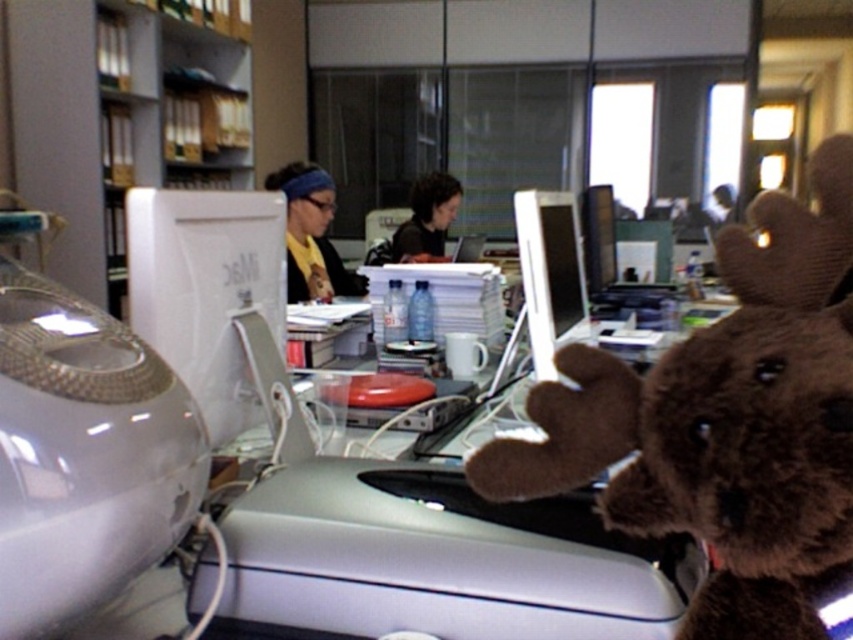
Does white plastic bookshelf at left have a greater width compared to matte black hairband at upper center?

Indeed, white plastic bookshelf at left has a greater width compared to matte black hairband at upper center.

Between white plastic bookshelf at left and matte black hairband at upper center, which one is positioned lower?

matte black hairband at upper center

Which is behind, point (73, 257) or point (291, 170)?

The point (291, 170) is behind.

Find the location of `white plastic bookshelf at left`. white plastic bookshelf at left is located at coordinates (120, 116).

Is matte black hairband at upper center smaller than dark brown plush toy at center?

Yes.

Does matte black hairband at upper center appear over dark brown plush toy at center?

No, matte black hairband at upper center is not above dark brown plush toy at center.

Does point (291, 244) come farther from viewer compared to point (430, 218)?

No, it is in front of (430, 218).

You are a GUI agent. You are given a task and a screenshot of the screen. Output one action in this format:
    pyautogui.click(x=<x>, y=<y>)
    Task: Click on the matte black hairband at upper center
    
    Given the screenshot: What is the action you would take?
    pyautogui.click(x=311, y=234)

Does point (219, 26) come behind point (532, 355)?

Yes, it is.

Image resolution: width=853 pixels, height=640 pixels. I want to click on white plastic bookshelf at left, so click(x=120, y=116).